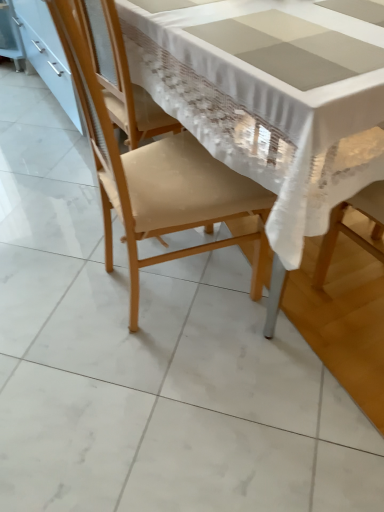
Image resolution: width=384 pixels, height=512 pixels. I want to click on free space that is to the left of white glossy cabinet at left, so click(23, 103).